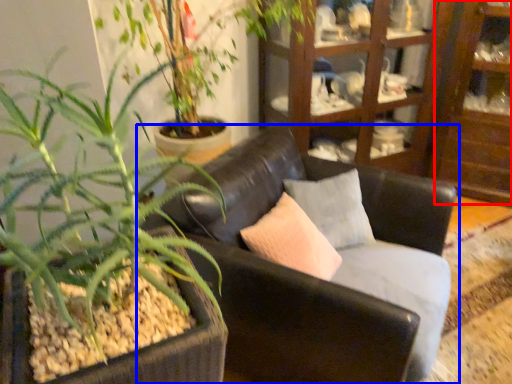
Question: Among these objects, which one is nearest to the camera, shelf (highlighted by a red box) or chair (highlighted by a blue box)?

Choices:
 (A) shelf
 (B) chair

Answer: (B)